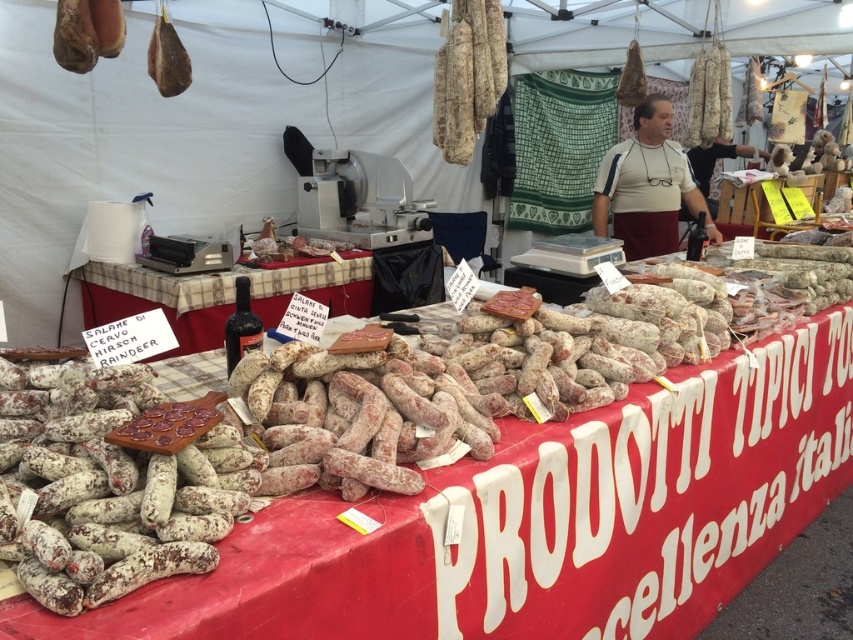
Which is more to the right, plaid fabric table at center or white fabric apron at center?

white fabric apron at center is more to the right.

Does point (325, 285) come in front of point (666, 221)?

Yes.

Locate an element on the screen. plaid fabric table at center is located at coordinates (219, 294).

Can you confirm if speckled white sausage at center is positioned to the right of matte brown cured meat at upper left?

Correct, you'll find speckled white sausage at center to the right of matte brown cured meat at upper left.

Measure the distance from speckled white sausage at center to matte brown cured meat at upper left.

2.21 meters

Locate an element on the screen. This screenshot has width=853, height=640. speckled white sausage at center is located at coordinates (109, 486).

The width and height of the screenshot is (853, 640). I want to click on speckled white sausage at center, so click(x=109, y=486).

Does white fabric apron at center appear on the left side of matte brown cured meat at upper left?

Incorrect, white fabric apron at center is not on the left side of matte brown cured meat at upper left.

Which is behind, point (602, 189) or point (189, 77)?

Point (602, 189)

This screenshot has height=640, width=853. In order to click on white fabric apron at center in this screenshot , I will do `click(647, 186)`.